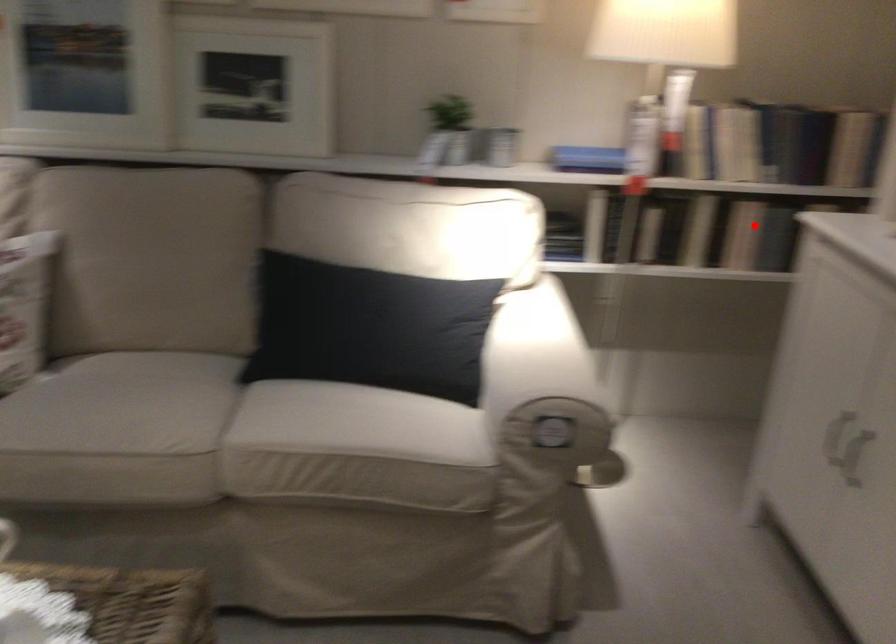
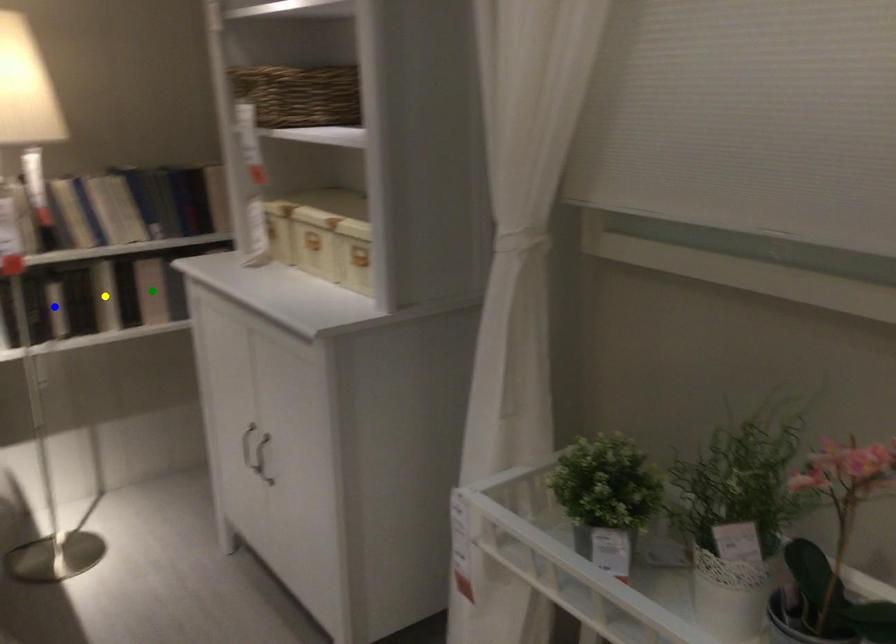
Question: I am providing you with two images of the same scene from different viewpoints. A red point is marked on the first image. You are given multiple points on the second image. Which point in image 2 represents the same 3d spot as the red point in image 1?

Choices:
 (A) green point
 (B) yellow point
 (C) blue point

Answer: (A)